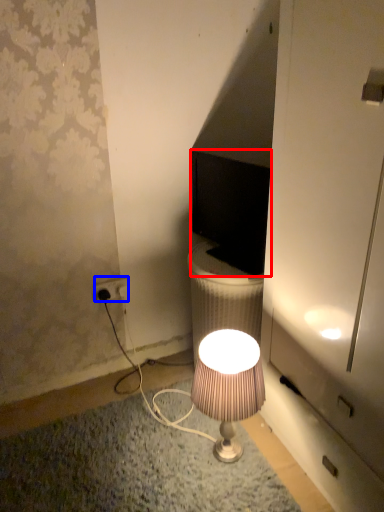
Question: Which of the following is the closest to the observer, computer monitor (highlighted by a red box) or power outlet (highlighted by a blue box)?

Choices:
 (A) computer monitor
 (B) power outlet

Answer: (A)